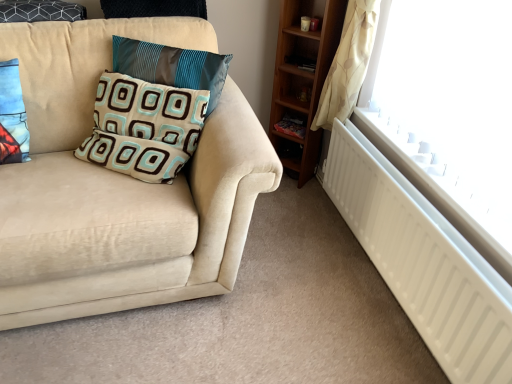
Question: From the image's perspective, is wooden shelf at lower right positioned above or below blue fabric pillow at left, the 1th pillow when ordered from left to right?

Choices:
 (A) below
 (B) above

Answer: (B)

Question: Is wooden shelf at lower right inside or outside of blue fabric pillow at left, the 1th pillow when ordered from left to right?

Choices:
 (A) outside
 (B) inside

Answer: (A)

Question: Which is farther from the wooden shelf at lower right?

Choices:
 (A) blue fabric pillow at left, the 1th pillow when ordered from left to right
 (B) teal satin pillow at upper left, arranged as the first pillow when viewed from the right
 (C) white matte radiator at lower right
 (D) patterned fabric pillow at center, acting as the 2th pillow starting from the right
 (E) suede beige couch at left

Answer: (A)

Question: Which is nearer to the patterned fabric pillow at center, acting as the 2th pillow starting from the right?

Choices:
 (A) blue fabric pillow at left, the 1th pillow when ordered from left to right
 (B) suede beige couch at left
 (C) wooden shelf at lower right
 (D) white matte radiator at lower right
 (E) teal satin pillow at upper left, arranged as the first pillow when viewed from the right

Answer: (E)